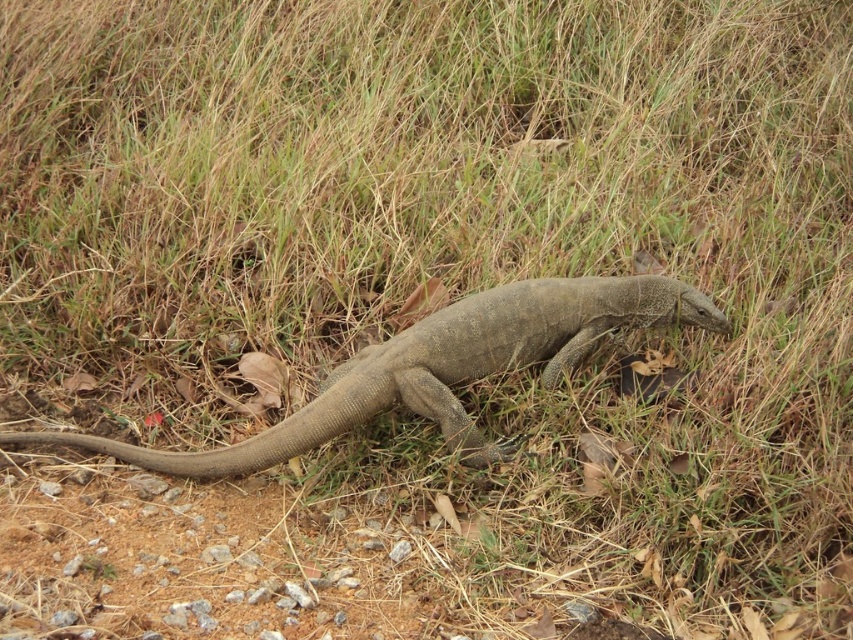
Who is higher up, gray textured lizard at center or brown rough tail at lower left?

gray textured lizard at center is higher up.

Between point (273, 435) and point (256, 442), which one is positioned behind?

Point (256, 442)

This screenshot has height=640, width=853. I want to click on gray textured lizard at center, so click(440, 369).